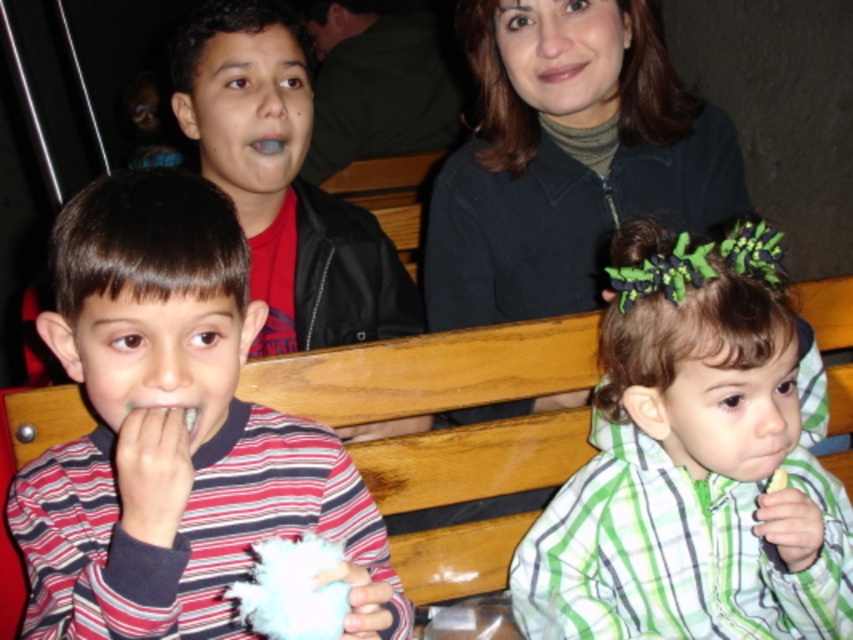
You are a photographer standing in front of the scene. You want to take a photo of the striped cotton shirt at left and the dark green turtleneck at upper center. Can you fit both in the frame if your camera has a 30 inch wide field of view?

The striped cotton shirt at left is 24.86 inches from the dark green turtneck at upper center. Since the distance between them is less than the camera field of view of 30 inches, both can be captured in the frame.

You are observing a group of people sitting on a bench. You need to determine which of the two individuals wearing the green plaid shirt at right and dark green turtleneck at upper center is shorter. Which one is shorter?

The green plaid shirt at right is shorter than the dark green turtleneck at upper center.